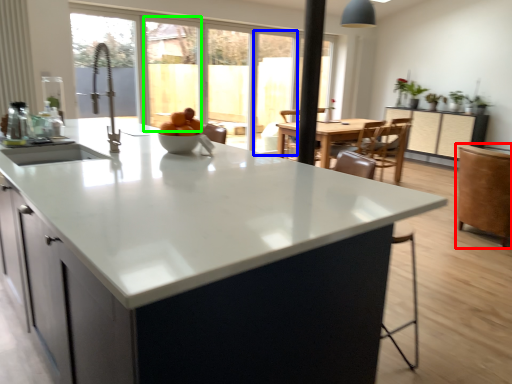
Question: Estimate the real-world distances between objects in this image. Which object is closer to swivel chair (highlighted by a red box), screen door (highlighted by a blue box) or window screen (highlighted by a green box)?

Choices:
 (A) screen door
 (B) window screen

Answer: (A)